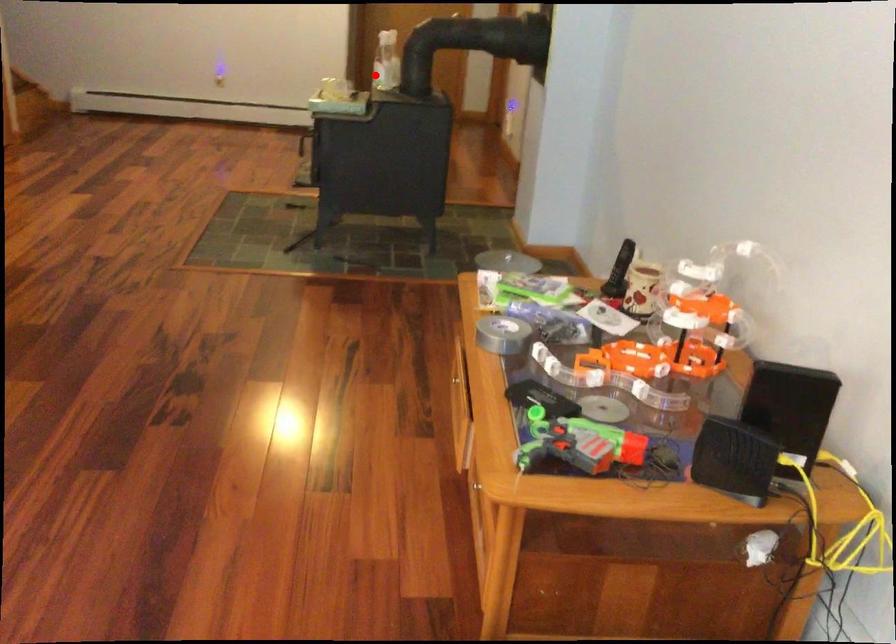
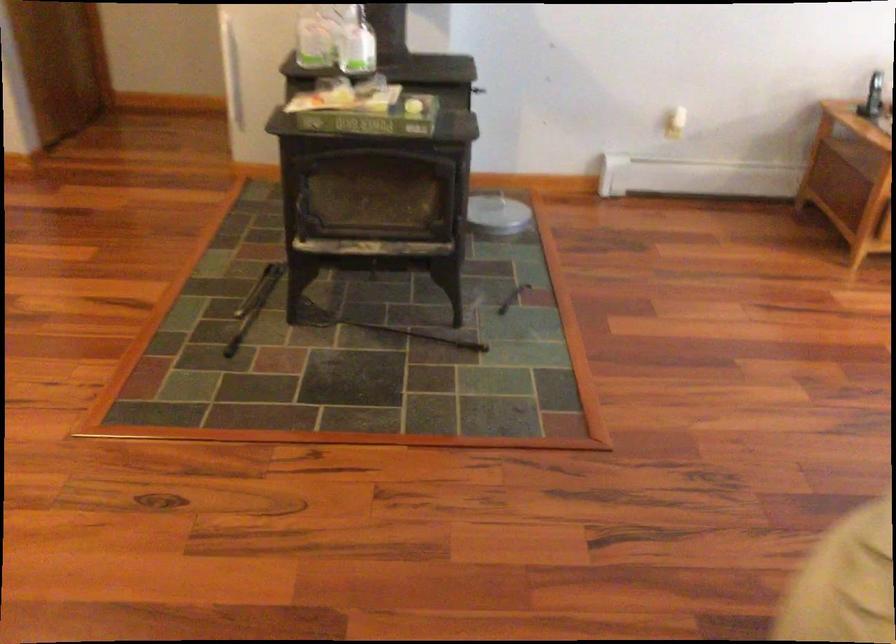
Locate, in the second image, the point that corresponds to the highlighted location in the first image.

(357, 46)